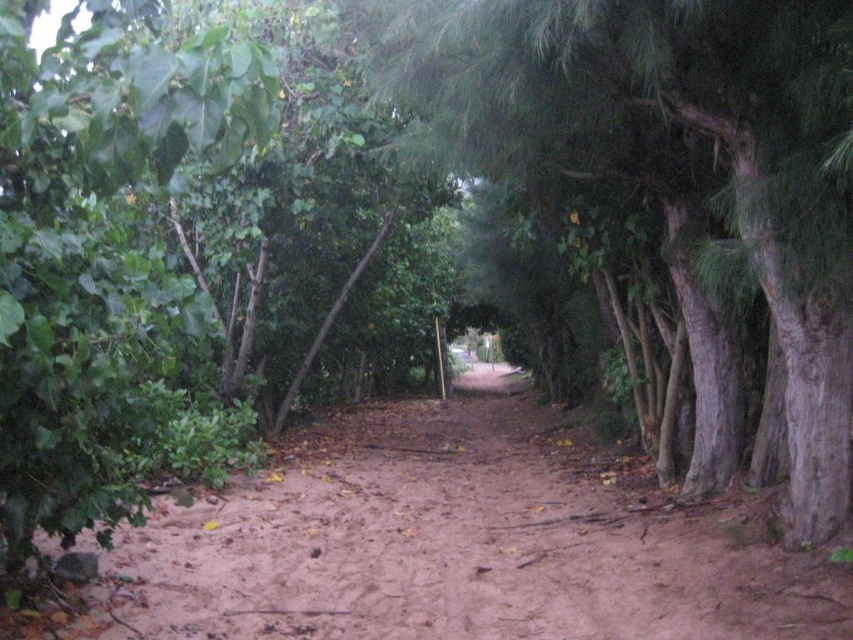
Question: Is brown dirt track at center positioned behind green rough bark tree at center?

Choices:
 (A) yes
 (B) no

Answer: (A)

Question: Which object is closer to the camera taking this photo?

Choices:
 (A) green rough bark tree at center
 (B) dirt path at center

Answer: (A)

Question: Considering the relative positions of green rough bark tree at center and dirt path at center in the image provided, where is green rough bark tree at center located with respect to dirt path at center?

Choices:
 (A) right
 (B) left

Answer: (B)

Question: Based on their relative distances, which object is farther from the brown dirt track at center?

Choices:
 (A) dirt path at center
 (B) green rough bark tree at center

Answer: (A)

Question: Can you confirm if green rough bark tree at center is positioned above dirt path at center?

Choices:
 (A) yes
 (B) no

Answer: (A)

Question: Which point is closer to the camera?

Choices:
 (A) brown dirt track at center
 (B) dirt path at center
 (C) green rough bark tree at center

Answer: (C)